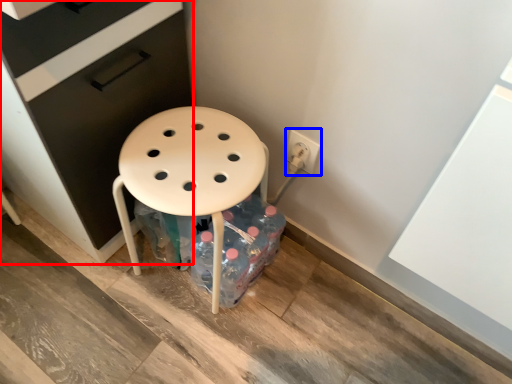
Question: Among these objects, which one is farthest to the camera, file cabinet (highlighted by a red box) or electric outlet (highlighted by a blue box)?

Choices:
 (A) file cabinet
 (B) electric outlet

Answer: (B)